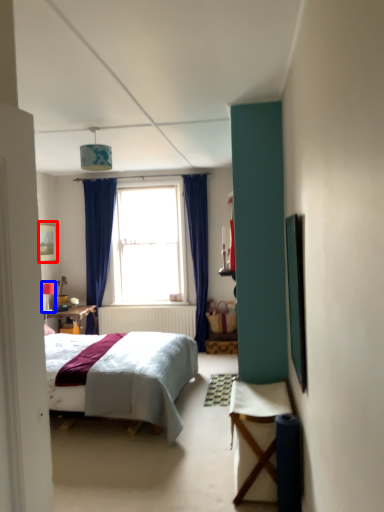
Question: Which of the following is the farthest to the observer, picture frame (highlighted by a red box) or lamp (highlighted by a blue box)?

Choices:
 (A) picture frame
 (B) lamp

Answer: (B)